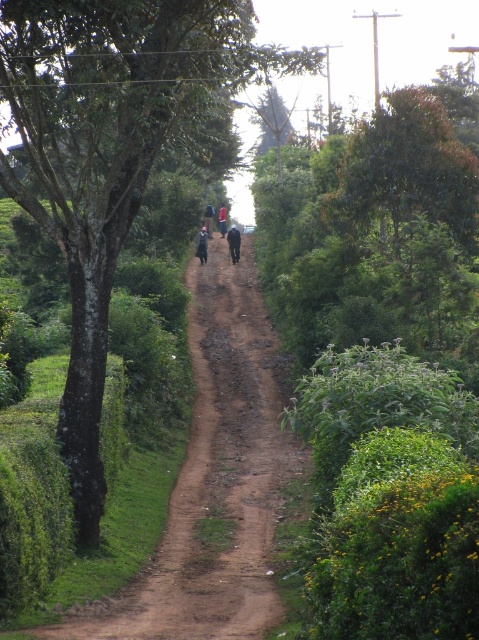
From the picture: You are standing at the starting point of the dirt path and want to reach the end. There are two points marked on the path, point [367,156] and point [198,240]. Which point should you pass first while moving along the path?

Point [367,156] is in front of point [198,240], so you should pass point [367,156] first while moving along the path.

You are a hiker who wants to know the position of your friend wearing a dark gray fabric jacket at center relative to your own dark blue fabric at center. From your perspective, is your friend to your left or right?

The dark blue fabric at center is to the right of the dark gray fabric jacket at center, so your friend wearing the dark gray fabric jacket at center is to your left.

You are a hiker planning to walk along the rural dirt path shown in the image. You notice a blue fabric motorcyclist at center and a dark blue jacket at center. Which of these two items is taller?

The blue fabric motorcyclist at center is taller than the dark blue jacket at center.